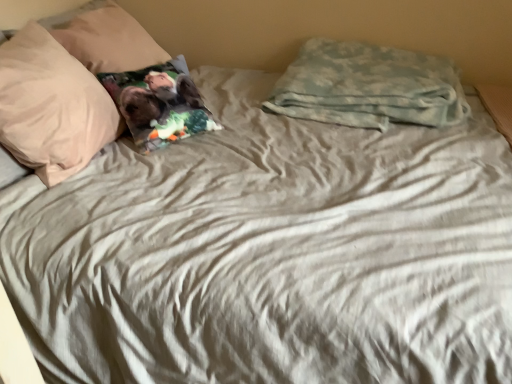
Question: Considering the relative positions of camouflage fabric pillow at upper right, which is the first pillow from right to left, and printed fabric pillow at left, the second pillow when ordered from left to right, in the image provided, is camouflage fabric pillow at upper right, which is the first pillow from right to left, to the right of printed fabric pillow at left, the second pillow when ordered from left to right, from the viewer's perspective?

Choices:
 (A) no
 (B) yes

Answer: (B)

Question: Is camouflage fabric pillow at upper right, which is the first pillow from right to left, aimed at printed fabric pillow at left, the second pillow when ordered from left to right?

Choices:
 (A) yes
 (B) no

Answer: (B)

Question: Is camouflage fabric pillow at upper right, which is the first pillow from right to left, wider than printed fabric pillow at left, the 3th pillow positioned from the right?

Choices:
 (A) no
 (B) yes

Answer: (A)

Question: Is camouflage fabric pillow at upper right, the 4th pillow in the left-to-right sequence, facing away from printed fabric pillow at left, the second pillow when ordered from left to right?

Choices:
 (A) yes
 (B) no

Answer: (B)

Question: Does camouflage fabric pillow at upper right, the 4th pillow in the left-to-right sequence, touch printed fabric pillow at left, the 3th pillow positioned from the right?

Choices:
 (A) no
 (B) yes

Answer: (A)

Question: Does camouflage fabric pillow at upper right, which is the first pillow from right to left, have a lesser height compared to printed fabric pillow at left, the 3th pillow positioned from the right?

Choices:
 (A) yes
 (B) no

Answer: (A)

Question: Is beige soft pillow at upper left, which is the fourth pillow in right-to-left order, not near printed fabric pillow at upper left, the 2th pillow positioned from the right?

Choices:
 (A) no
 (B) yes

Answer: (A)

Question: From the image's perspective, is beige soft pillow at upper left, arranged as the 1th pillow when viewed from the left, located beneath printed fabric pillow at upper left, the 2th pillow positioned from the right?

Choices:
 (A) yes
 (B) no

Answer: (A)

Question: Considering the relative sizes of beige soft pillow at upper left, arranged as the 1th pillow when viewed from the left, and printed fabric pillow at upper left, the 2th pillow positioned from the right, in the image provided, is beige soft pillow at upper left, arranged as the 1th pillow when viewed from the left, shorter than printed fabric pillow at upper left, the 2th pillow positioned from the right,?

Choices:
 (A) no
 (B) yes

Answer: (A)

Question: Is beige soft pillow at upper left, arranged as the 1th pillow when viewed from the left, facing towards printed fabric pillow at upper left, which is counted as the 3th pillow, starting from the left?

Choices:
 (A) no
 (B) yes

Answer: (A)

Question: Are beige soft pillow at upper left, arranged as the 1th pillow when viewed from the left, and printed fabric pillow at upper left, which is counted as the 3th pillow, starting from the left, beside each other?

Choices:
 (A) no
 (B) yes

Answer: (A)

Question: Can you confirm if beige soft pillow at upper left, arranged as the 1th pillow when viewed from the left, is positioned to the left of printed fabric pillow at upper left, the 2th pillow positioned from the right?

Choices:
 (A) no
 (B) yes

Answer: (B)

Question: Is printed fabric pillow at upper left, the 2th pillow positioned from the right, positioned in front of camouflage fabric pillow at upper right, the 4th pillow in the left-to-right sequence?

Choices:
 (A) no
 (B) yes

Answer: (B)